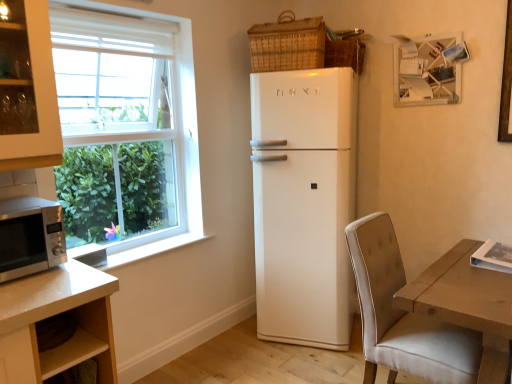
Question: Is woven wicker basket at upper right, the 1th basket positioned from the right, thinner than white glossy refrigerator at center?

Choices:
 (A) no
 (B) yes

Answer: (B)

Question: Does woven wicker basket at upper right, the 2th basket from the left, turn towards white glossy refrigerator at center?

Choices:
 (A) no
 (B) yes

Answer: (A)

Question: Is woven wicker basket at upper right, the 1th basket positioned from the right, directly adjacent to white glossy refrigerator at center?

Choices:
 (A) no
 (B) yes

Answer: (A)

Question: From a real-world perspective, is woven wicker basket at upper right, the 2th basket from the left, below white glossy refrigerator at center?

Choices:
 (A) yes
 (B) no

Answer: (B)

Question: From the image's perspective, is woven wicker basket at upper right, the 1th basket positioned from the right, under white glossy refrigerator at center?

Choices:
 (A) yes
 (B) no

Answer: (B)

Question: Considering their positions, is satin silver microwave at lower left located in front of or behind woven brown basket at upper right, acting as the second basket starting from the right?

Choices:
 (A) behind
 (B) front

Answer: (B)

Question: Would you say satin silver microwave at lower left is inside or outside woven brown basket at upper right, acting as the second basket starting from the right?

Choices:
 (A) outside
 (B) inside

Answer: (A)

Question: Is satin silver microwave at lower left bigger or smaller than woven brown basket at upper right, arranged as the 1th basket when viewed from the left?

Choices:
 (A) big
 (B) small

Answer: (B)

Question: In terms of width, does satin silver microwave at lower left look wider or thinner when compared to woven brown basket at upper right, acting as the second basket starting from the right?

Choices:
 (A) wide
 (B) thin

Answer: (A)

Question: Considering the positions of woven brown basket at upper right, acting as the second basket starting from the right, and white glossy refrigerator at center in the image, is woven brown basket at upper right, acting as the second basket starting from the right, wider or thinner than white glossy refrigerator at center?

Choices:
 (A) wide
 (B) thin

Answer: (B)

Question: From the image's perspective, is woven brown basket at upper right, arranged as the 1th basket when viewed from the left, above or below white glossy refrigerator at center?

Choices:
 (A) above
 (B) below

Answer: (A)

Question: Considering the positions of point (307, 57) and point (306, 226), is point (307, 57) closer or farther from the camera than point (306, 226)?

Choices:
 (A) closer
 (B) farther

Answer: (A)

Question: Choose the correct answer: Is woven brown basket at upper right, acting as the second basket starting from the right, inside white glossy refrigerator at center or outside it?

Choices:
 (A) inside
 (B) outside

Answer: (B)

Question: Considering the relative positions of white matte picture frame at upper right and white glossy refrigerator at center in the image provided, is white matte picture frame at upper right to the left or to the right of white glossy refrigerator at center?

Choices:
 (A) left
 (B) right

Answer: (B)

Question: Considering the positions of white matte picture frame at upper right and white glossy refrigerator at center in the image, is white matte picture frame at upper right bigger or smaller than white glossy refrigerator at center?

Choices:
 (A) big
 (B) small

Answer: (B)